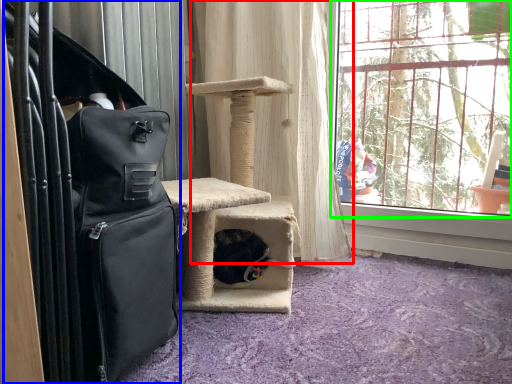
Question: Which object is the farthest from curtain (highlighted by a red box)? Choose among these: luggage (highlighted by a blue box) or window (highlighted by a green box).

Choices:
 (A) luggage
 (B) window

Answer: (A)